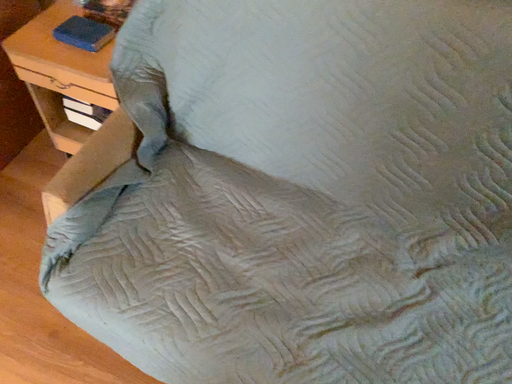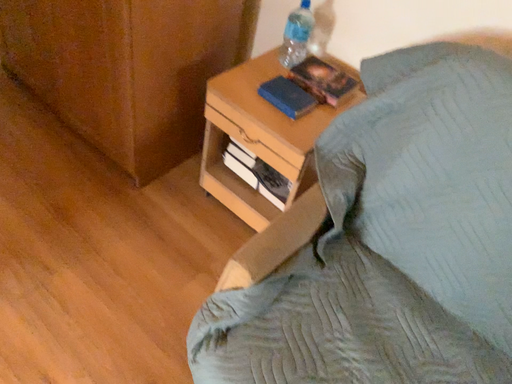
Question: Which way did the camera rotate in the video?

Choices:
 (A) rotated upward
 (B) rotated downward

Answer: (A)